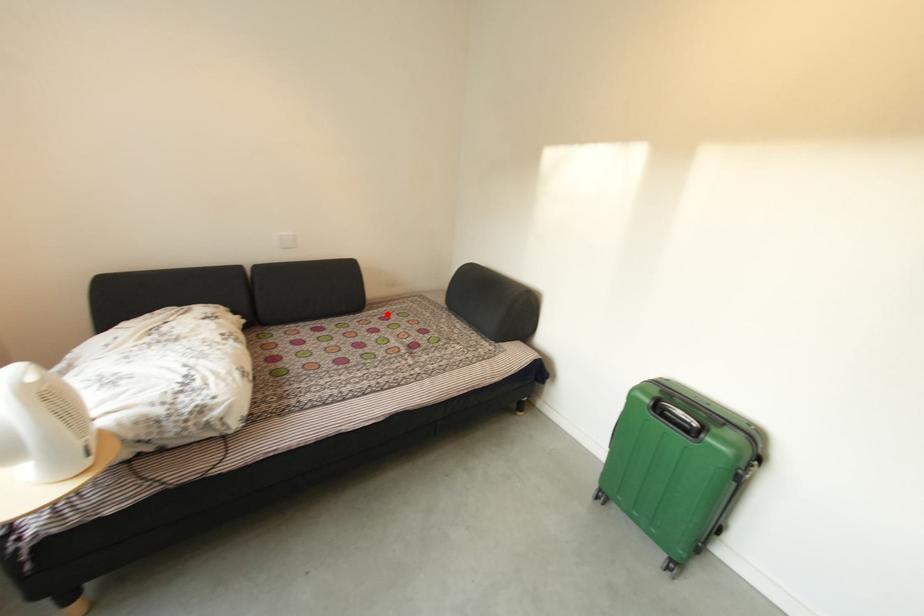
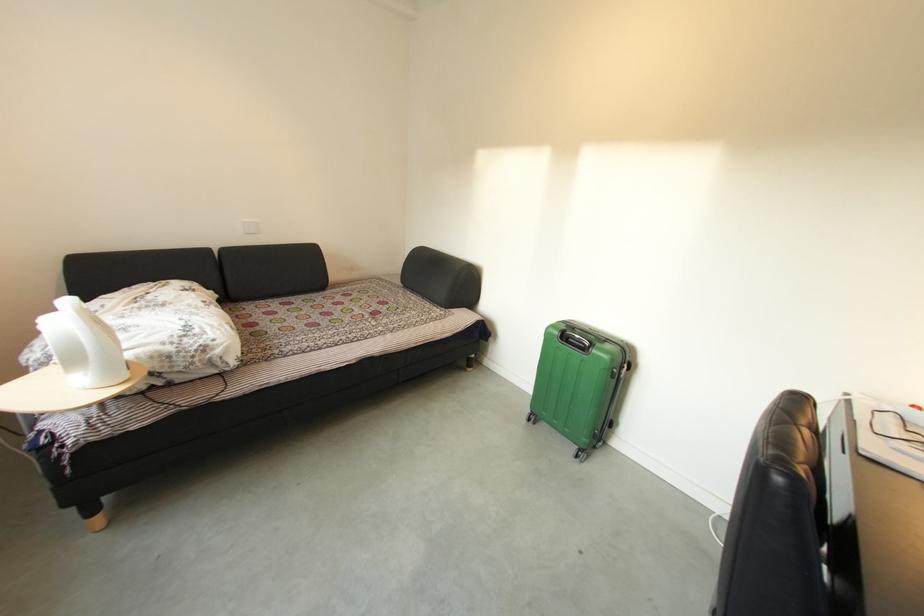
The point at the highlighted location is marked in the first image. Where is the corresponding point in the second image?

(349, 293)